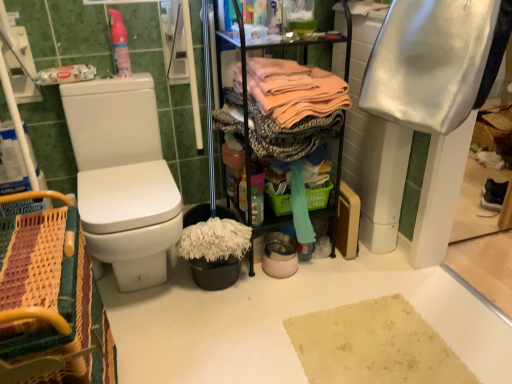
Locate an element on the screen. The image size is (512, 384). vacant space in white satin towel at upper right, the first clothing from the right (from a real-world perspective) is located at coordinates (392, 276).